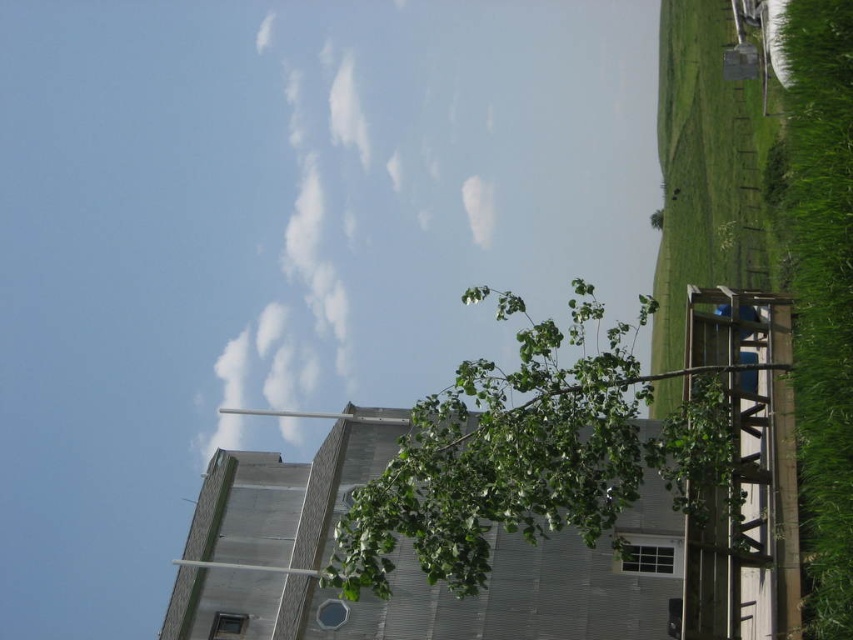
What are the coordinates of the white fluffy cloud at upper center in the image?

The white fluffy cloud at upper center is located at point coordinates of (445, 186).

You are standing in the rural scene described. There is a point at coordinates [445,186]. What object is this point located on?

The point at coordinates [445,186] is located on the white fluffy cloud at upper center.

You are a landscape architect planning to install a new garden. You notice the green grass at right and the green leafy tree at upper right in the image. Which of these two elements occupies a larger area in the scene?

The green grass at right occupies a larger area than the green leafy tree at upper right according to the description.